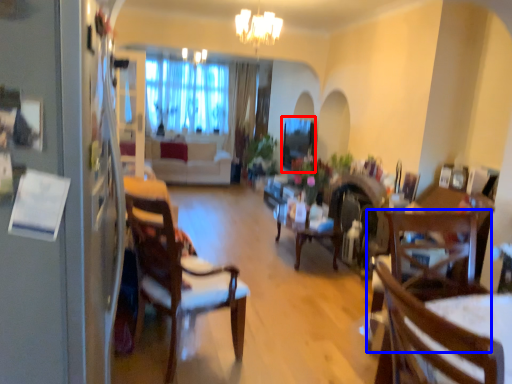
Question: Which point is further to the camera, window screen (highlighted by a red box) or chair (highlighted by a blue box)?

Choices:
 (A) window screen
 (B) chair

Answer: (A)